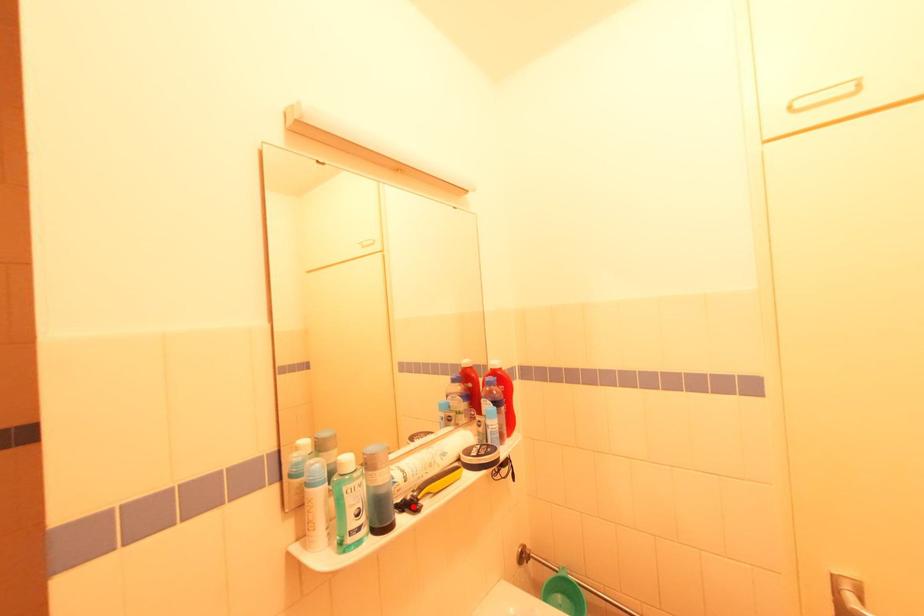
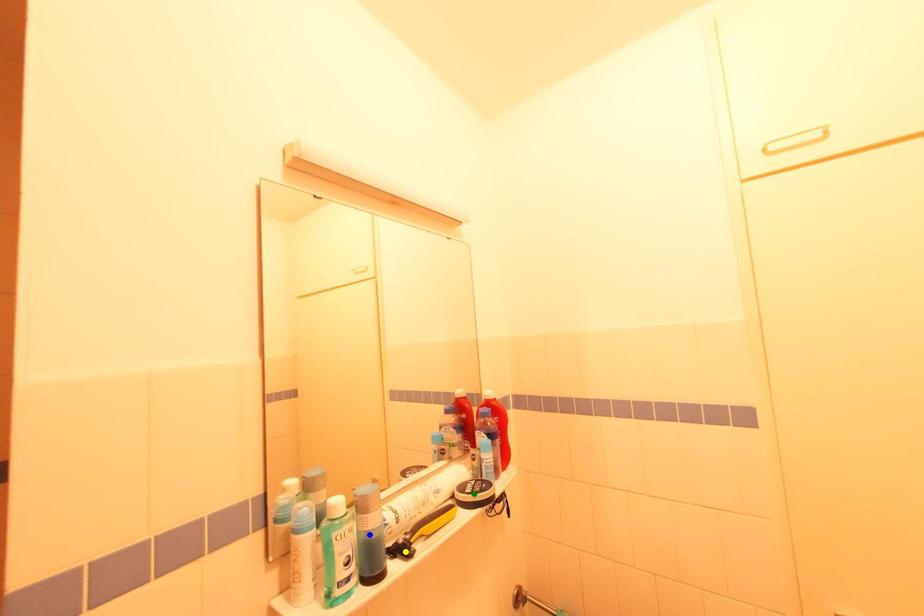
Question: I am providing you with two images of the same scene from different viewpoints. A red point is marked on the first image. You are given multiple points on the second image. Which point in image 2 represents the same 3d spot as the red point in image 1?

Choices:
 (A) blue point
 (B) yellow point
 (C) green point

Answer: (B)